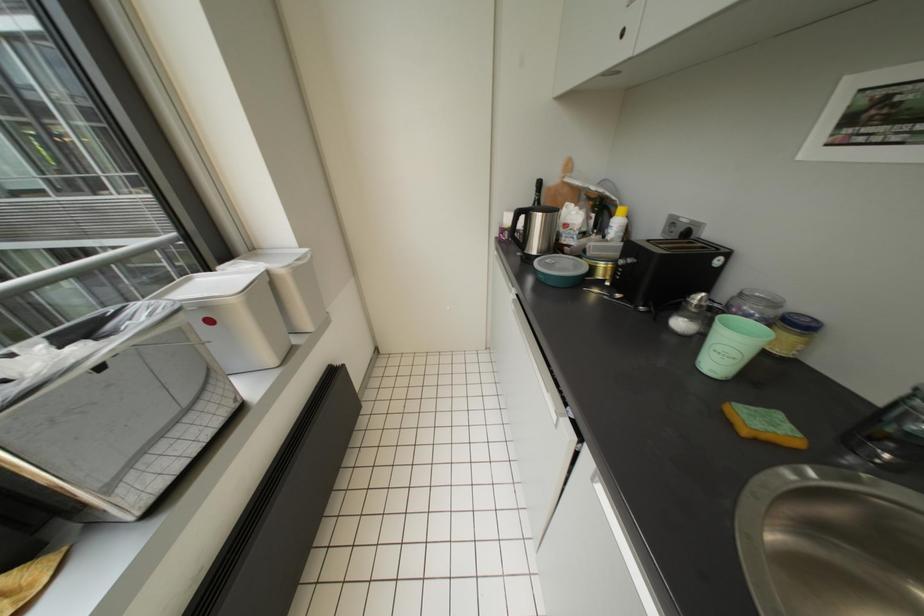
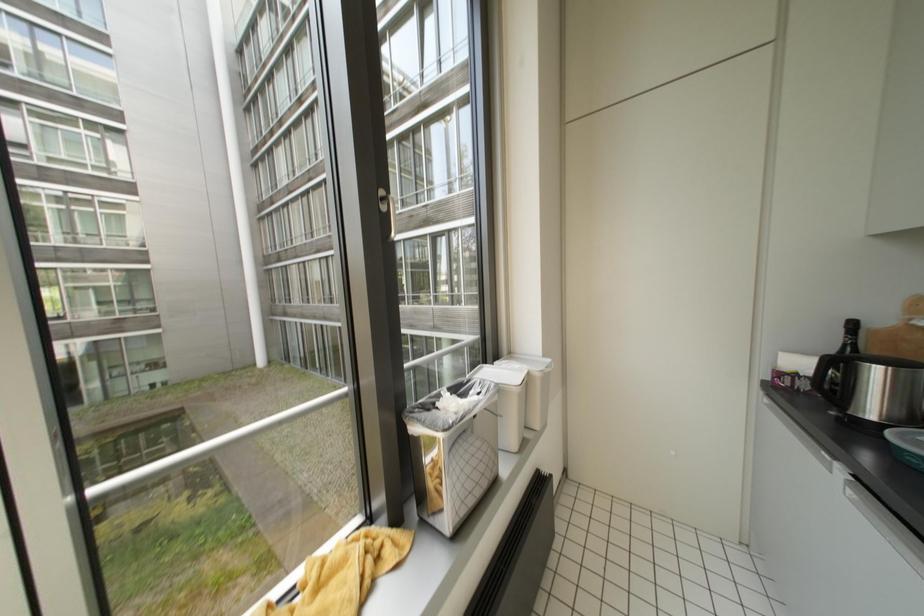
Based on the continuous images, in which direction is the camera rotating?

The camera's rotation is toward left-up.